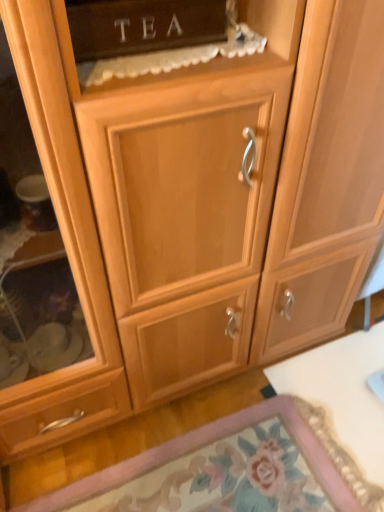
Question: Can you confirm if white glossy table at lower right is wider than wooden cabinet door at lower center?

Choices:
 (A) no
 (B) yes

Answer: (A)

Question: Is wooden cabinet door at lower center inside white glossy table at lower right?

Choices:
 (A) no
 (B) yes

Answer: (A)

Question: Is white glossy table at lower right oriented towards wooden cabinet door at lower center?

Choices:
 (A) no
 (B) yes

Answer: (B)

Question: Does white glossy table at lower right have a lesser height compared to wooden cabinet door at lower center?

Choices:
 (A) yes
 (B) no

Answer: (B)

Question: Is white glossy table at lower right closer to the viewer compared to wooden cabinet door at lower center?

Choices:
 (A) yes
 (B) no

Answer: (B)

Question: From the image's perspective, relative to white glossy table at lower right, is matte wood tea cabinet at upper center above or below?

Choices:
 (A) below
 (B) above

Answer: (B)

Question: From a real-world perspective, is matte wood tea cabinet at upper center physically located above or below white glossy table at lower right?

Choices:
 (A) above
 (B) below

Answer: (A)

Question: Considering their positions, is matte wood tea cabinet at upper center located in front of or behind white glossy table at lower right?

Choices:
 (A) behind
 (B) front

Answer: (B)

Question: Is matte wood tea cabinet at upper center taller or shorter than white glossy table at lower right?

Choices:
 (A) short
 (B) tall

Answer: (B)

Question: From the image's perspective, is wooden cabinet door at lower center positioned above or below matte wood tea cabinet at upper center?

Choices:
 (A) below
 (B) above

Answer: (A)

Question: Visually, is wooden cabinet door at lower center positioned to the left or to the right of matte wood tea cabinet at upper center?

Choices:
 (A) right
 (B) left

Answer: (A)

Question: Is wooden cabinet door at lower center spatially inside matte wood tea cabinet at upper center, or outside of it?

Choices:
 (A) inside
 (B) outside

Answer: (B)

Question: From a real-world perspective, is wooden cabinet door at lower center physically located above or below matte wood tea cabinet at upper center?

Choices:
 (A) above
 (B) below

Answer: (B)

Question: Considering the positions of point (96, 52) and point (296, 481), is point (96, 52) closer or farther from the camera than point (296, 481)?

Choices:
 (A) closer
 (B) farther

Answer: (A)

Question: In terms of height, does matte wood tea cabinet at upper center look taller or shorter compared to wooden cabinet door at lower center?

Choices:
 (A) tall
 (B) short

Answer: (A)